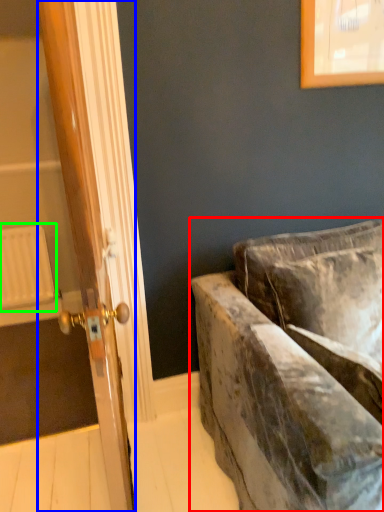
Question: Based on their relative distances, which object is nearer to studio couch (highlighted by a red box)? Choose from door (highlighted by a blue box) and radiator (highlighted by a green box).

Choices:
 (A) door
 (B) radiator

Answer: (A)